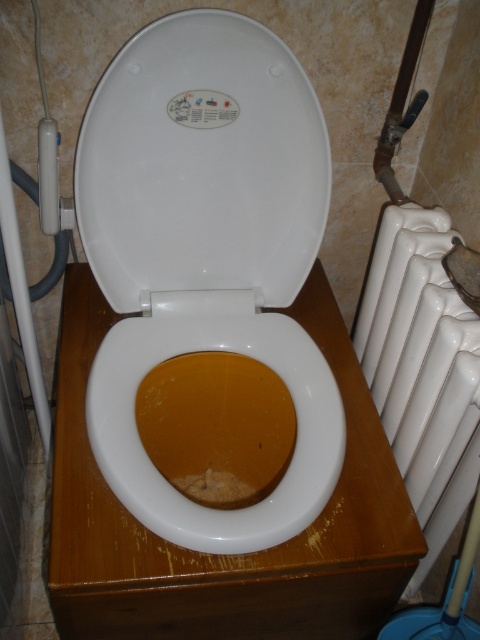
Question: Can you confirm if white glossy toilet seat at center is positioned to the left of white glossy radiator at right?

Choices:
 (A) yes
 (B) no

Answer: (A)

Question: Among these objects, which one is nearest to the camera?

Choices:
 (A) brown matte toilet bowl at center
 (B) white glossy toilet seat at center
 (C) white glossy radiator at right

Answer: (A)

Question: Can you confirm if white glossy toilet seat at center is positioned above brown matte toilet bowl at center?

Choices:
 (A) no
 (B) yes

Answer: (B)

Question: Which object is positioned closest to the white glossy radiator at right?

Choices:
 (A) white glossy toilet seat at center
 (B) brown matte toilet bowl at center

Answer: (B)

Question: Which object appears closest to the camera in this image?

Choices:
 (A) white glossy radiator at right
 (B) white glossy toilet seat at center

Answer: (A)

Question: Observing the image, what is the correct spatial positioning of white glossy toilet seat at center in reference to white glossy radiator at right?

Choices:
 (A) left
 (B) right

Answer: (A)